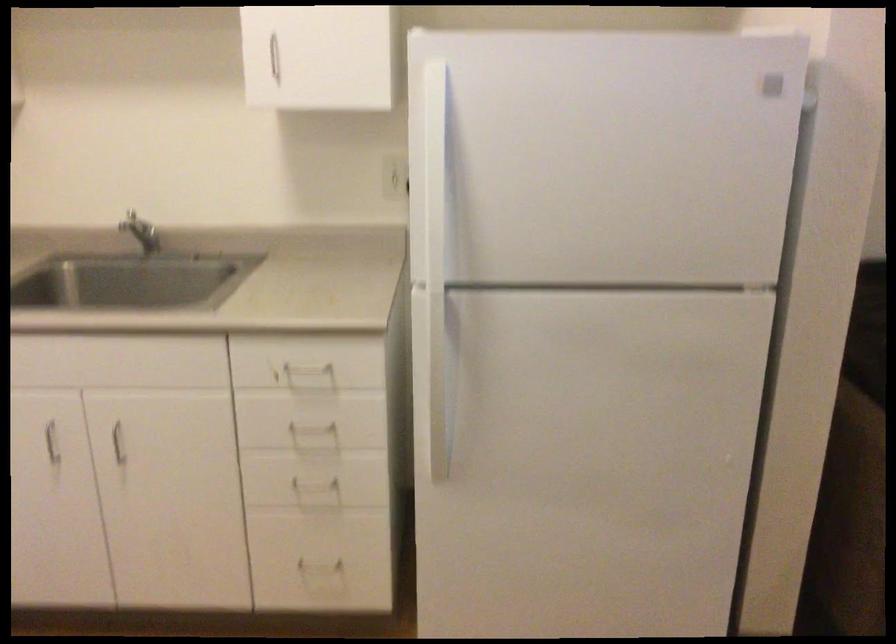
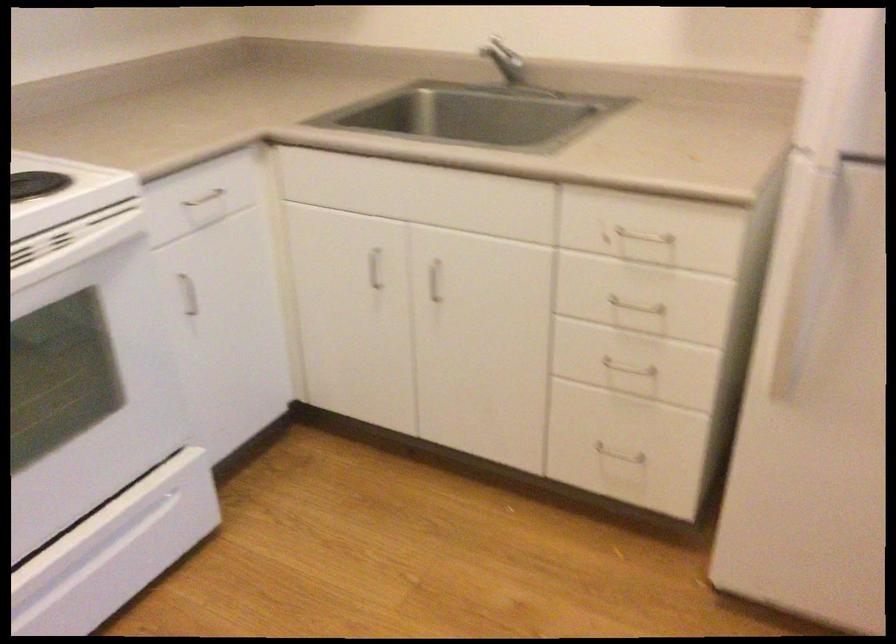
Question: I am providing you with two images of the same scene from different viewpoints. Which of the following objects are not visible in image2?

Choices:
 (A) silver faucet handle
 (B) metal pull handle
 (C) white oven handle
 (D) none of these

Answer: (D)